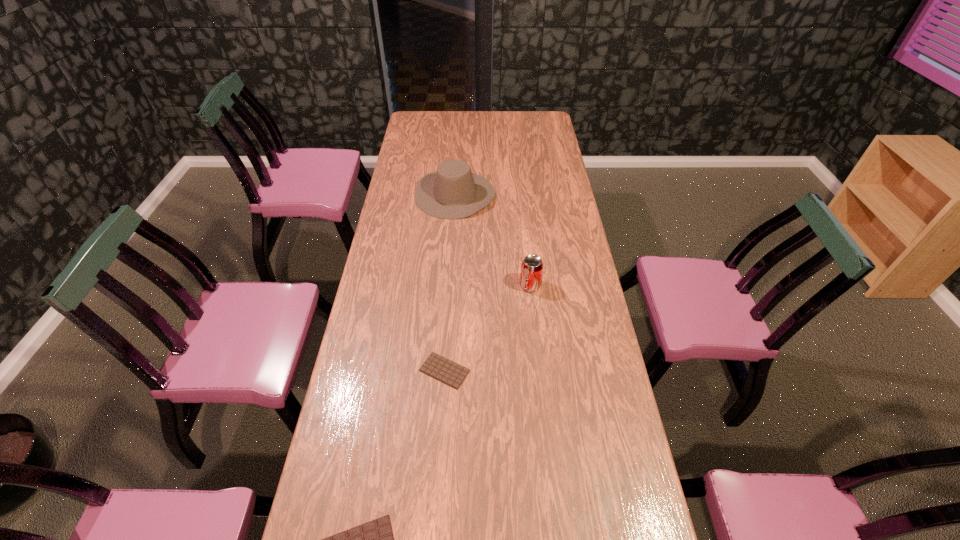
Where is `vacant space at the left edge of the desktop`? The height and width of the screenshot is (540, 960). vacant space at the left edge of the desktop is located at coordinates pyautogui.click(x=408, y=251).

Identify the location of vacant space at the right edge of the desktop. The image size is (960, 540). (534, 146).

The image size is (960, 540). I want to click on free spot between the cowboy hat and the second farthest object, so click(x=492, y=240).

The height and width of the screenshot is (540, 960). What are the coordinates of `free spot between the soda can and the taller chocolate bar` in the screenshot? It's located at (488, 328).

Where is `free space between the third nearest object and the taller chocolate bar`? This screenshot has width=960, height=540. free space between the third nearest object and the taller chocolate bar is located at coordinates [488, 328].

Locate an element on the screen. unoccupied position between the farthest object and the third tallest object is located at coordinates (450, 282).

Select which object is the second closest to the shorter chocolate bar. Please provide its 2D coordinates. Your answer should be formatted as a tuple, i.e. [(x, y)], where the tuple contains the x and y coordinates of a point satisfying the conditions above.

[(532, 266)]

The height and width of the screenshot is (540, 960). I want to click on object that is the closest to the left chocolate bar, so click(436, 366).

The width and height of the screenshot is (960, 540). Identify the location of vacant space that satisfies the following two spatial constraints: 1. on the back side of the right chocolate bar; 2. on the right side of the soda can. (450, 286).

At what (x,y) coordinates should I click in order to perform the action: click on free space that satisfies the following two spatial constraints: 1. on the front side of the cowboy hat; 2. on the right side of the right chocolate bar. Please return your answer as a coordinate pair (x, y). Looking at the image, I should click on (444, 371).